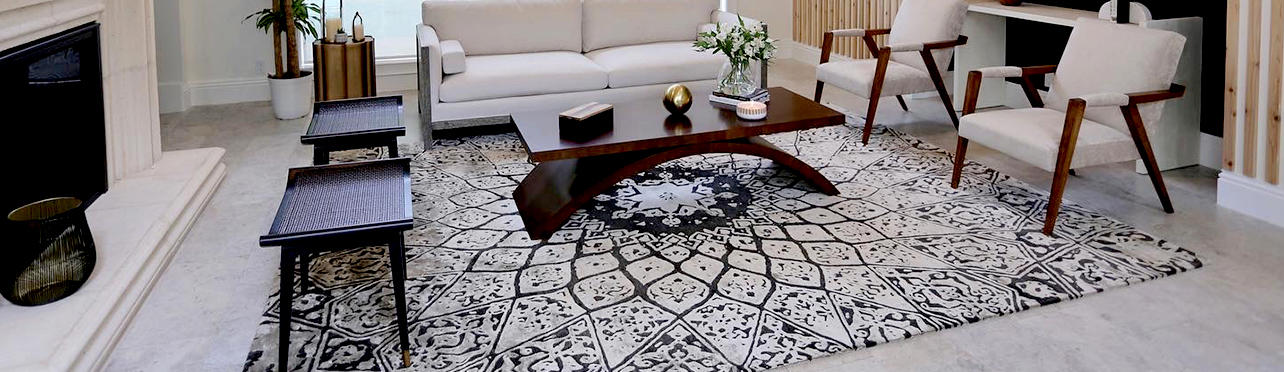
Locate an element on the screen. Image resolution: width=1284 pixels, height=372 pixels. plant holder is located at coordinates (289, 93), (736, 82).